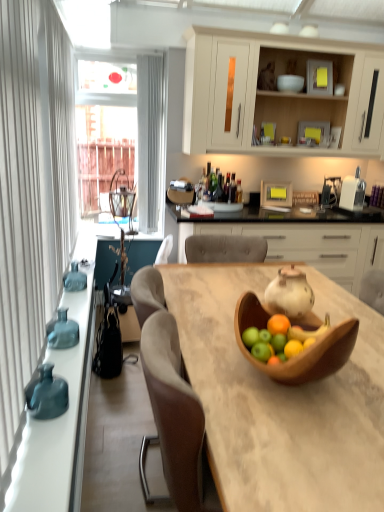
Locate an element on the screen. The width and height of the screenshot is (384, 512). free space that is to the left of wooden bowl at center is located at coordinates (211, 368).